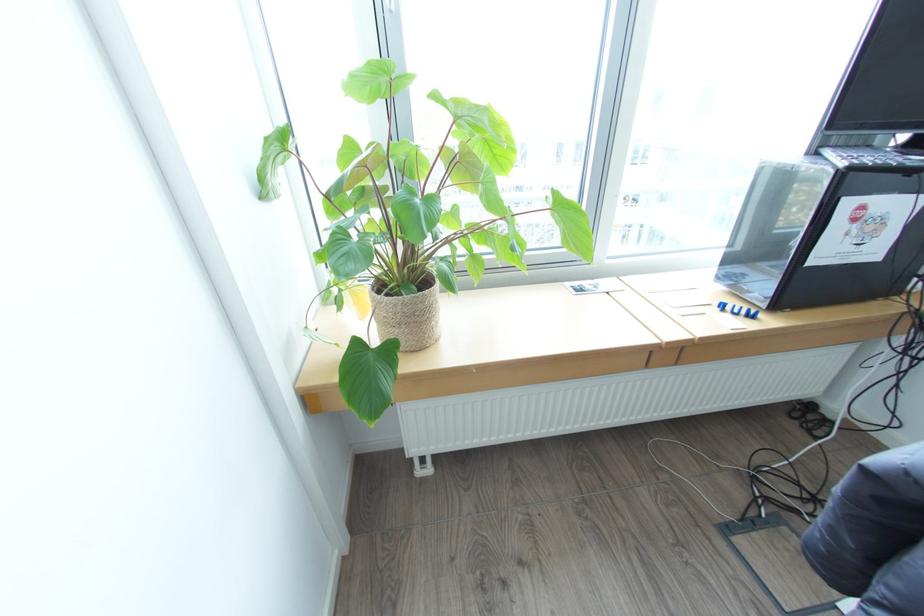
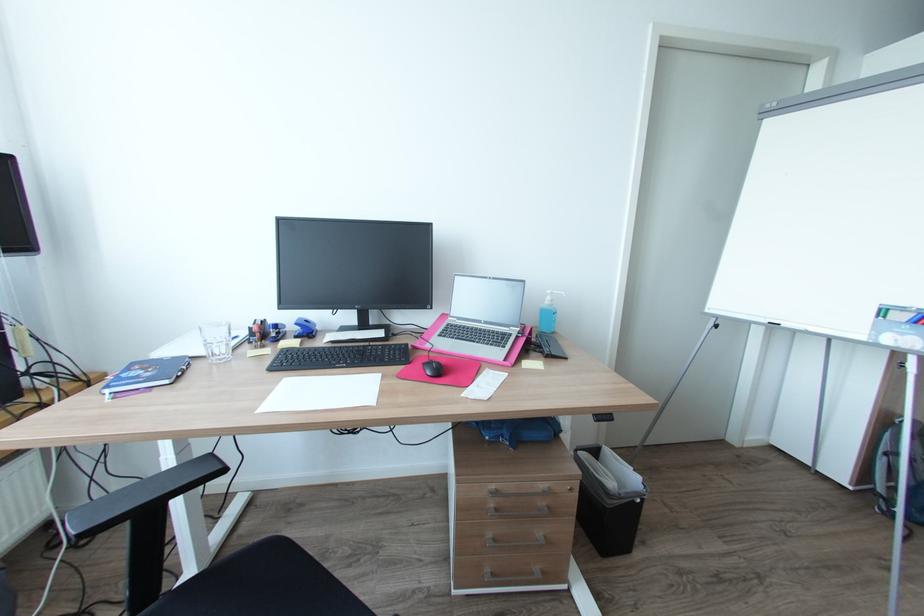
Question: Based on the continuous images, in which direction is the camera rotating? Reply with the corresponding letter.

Choices:
 (A) Left
 (B) Right
 (C) Up
 (D) Down

Answer: (B)